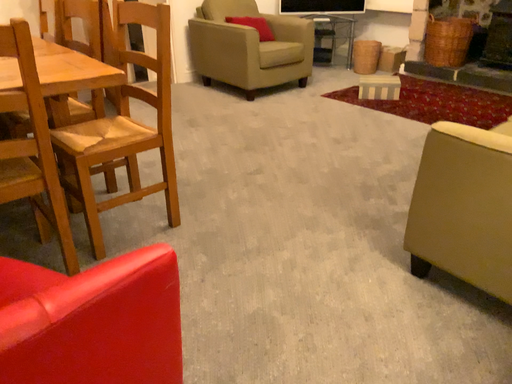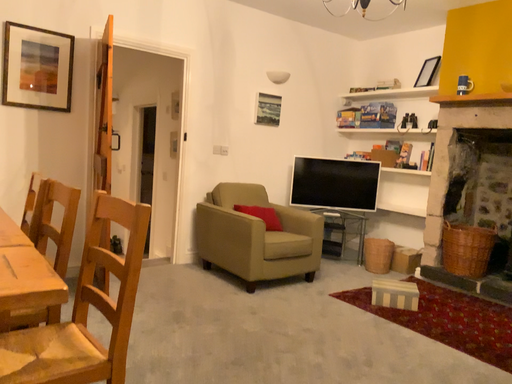
Question: How did the camera likely rotate when shooting the video?

Choices:
 (A) rotated upward
 (B) rotated downward

Answer: (A)